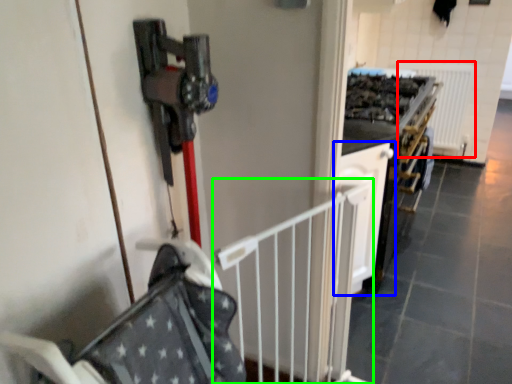
Question: Considering the real-world distances, which object is farthest from radiator (highlighted by a red box)? cabinetry (highlighted by a blue box) or rail (highlighted by a green box)?

Choices:
 (A) cabinetry
 (B) rail

Answer: (B)